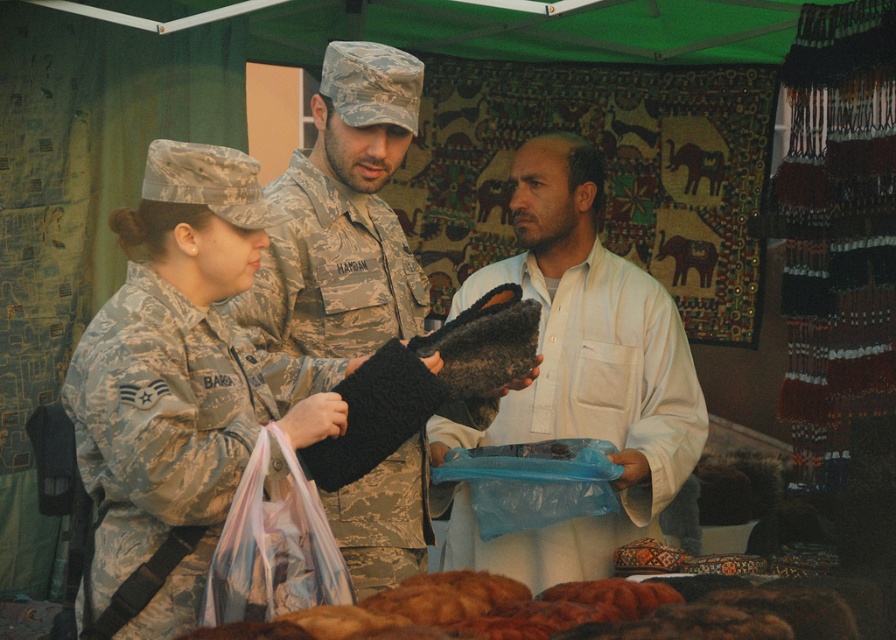
Question: Based on their relative distances, which object is nearer to the white cotton shirt at center?

Choices:
 (A) dark brown fuzzy slippers at center
 (B) camouflage fabric uniform at center
 (C) fuzzy brown bread at lower center

Answer: (A)

Question: Can you confirm if white cotton shirt at center is thinner than dark brown fuzzy slippers at center?

Choices:
 (A) no
 (B) yes

Answer: (A)

Question: Can you confirm if white cotton shirt at center is positioned to the right of dark brown fuzzy slippers at center?

Choices:
 (A) yes
 (B) no

Answer: (A)

Question: Based on their relative distances, which object is nearer to the camouflage fabric uniform at center?

Choices:
 (A) fuzzy brown bread at lower center
 (B) dark brown fuzzy slippers at center

Answer: (B)

Question: Which is nearer to the fuzzy brown bread at lower center?

Choices:
 (A) camouflage fabric uniform at center
 (B) dark brown fuzzy slippers at center
 (C) white cotton shirt at center

Answer: (A)

Question: Is the position of white cotton shirt at center more distant than that of camouflage fabric uniform at center?

Choices:
 (A) no
 (B) yes

Answer: (B)